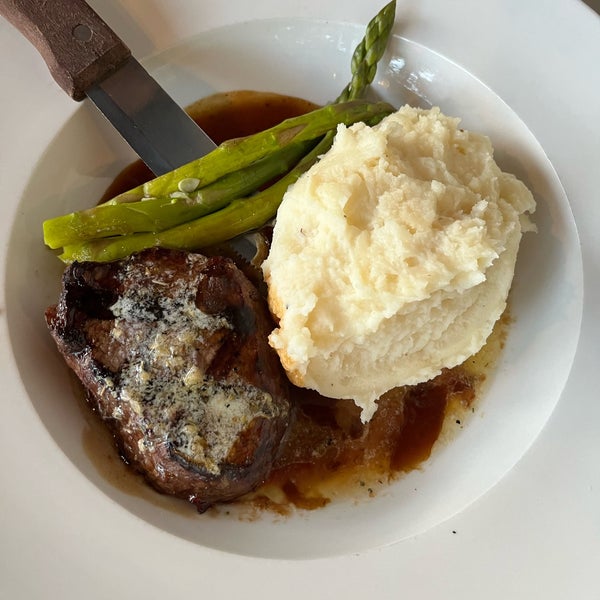
This screenshot has height=600, width=600. I want to click on white background, countertop, so click(352, 577).